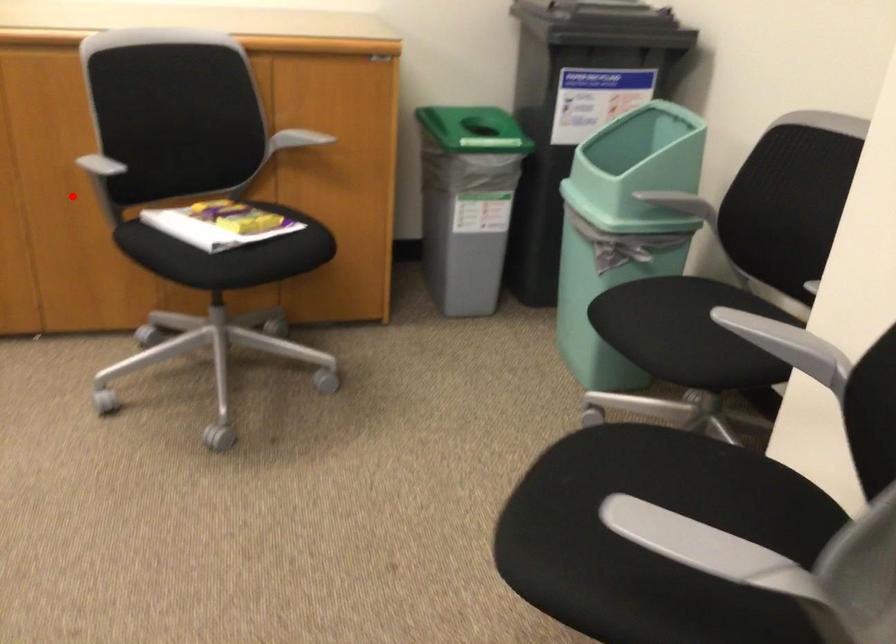
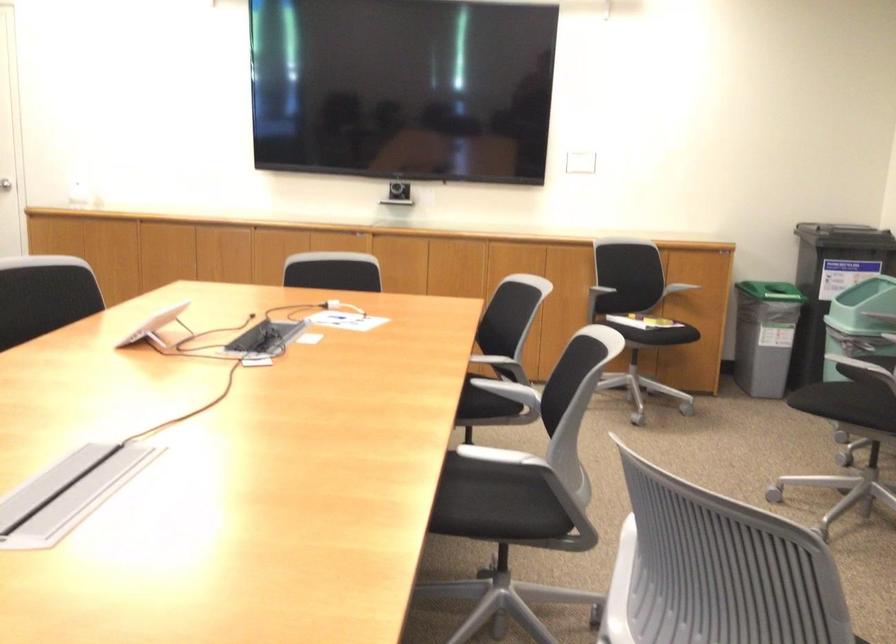
Question: I am providing you with two images of the same scene from different viewpoints. In image1, a red point is highlighted. Considering the same 3D point in image2, which of the following is correct?

Choices:
 (A) It is closer
 (B) It is farther

Answer: (B)